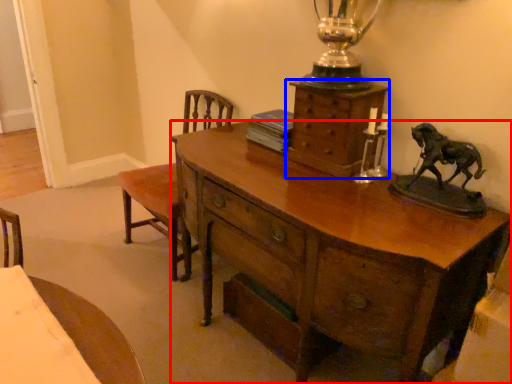
Question: Among these objects, which one is nearest to the camera, desk (highlighted by a red box) or chest of drawers (highlighted by a blue box)?

Choices:
 (A) desk
 (B) chest of drawers

Answer: (A)